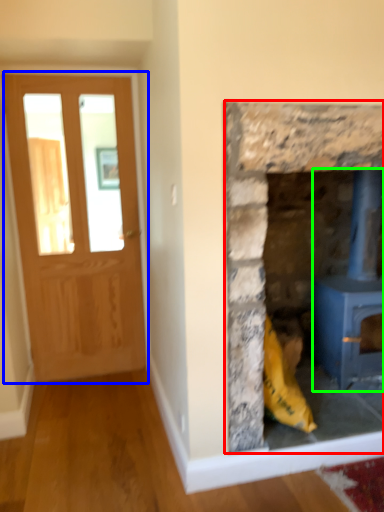
Question: Which object is positioned farthest from fireplace (highlighted by a red box)? Select from glass door (highlighted by a blue box) and wood burning stove (highlighted by a green box).

Choices:
 (A) glass door
 (B) wood burning stove

Answer: (A)